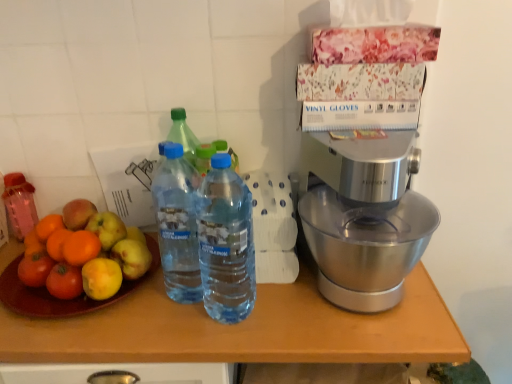
Where is `free spot in front of transparent plastic bottle at center, the first bottle positioned from the right`? The width and height of the screenshot is (512, 384). free spot in front of transparent plastic bottle at center, the first bottle positioned from the right is located at coordinates (234, 346).